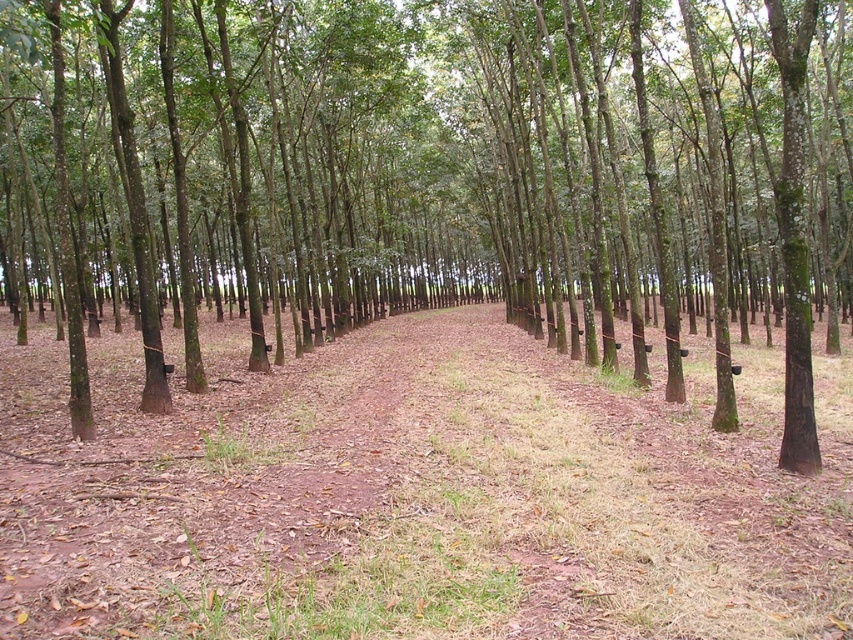
Does brown smooth tree at center appear on the left side of brown dirt trail at center?

Indeed, brown smooth tree at center is positioned on the left side of brown dirt trail at center.

Is brown smooth tree at center positioned in front of brown dirt trail at center?

No, it is behind brown dirt trail at center.

Who is more distant from viewer, (283, 161) or (759, 557)?

The point (283, 161) is behind.

Image resolution: width=853 pixels, height=640 pixels. Identify the location of brown smooth tree at center. (432, 177).